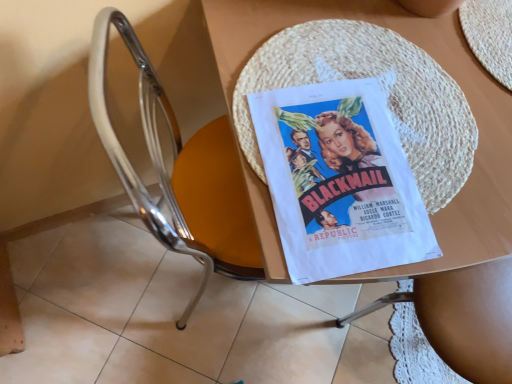
Question: Considering the positions of point (306, 223) and point (94, 105), is point (306, 223) closer or farther from the camera than point (94, 105)?

Choices:
 (A) closer
 (B) farther

Answer: (A)

Question: In terms of height, does white paper poster at center look taller or shorter compared to metallic chrome chair at center?

Choices:
 (A) tall
 (B) short

Answer: (B)

Question: Estimate the real-world distances between objects in this image. Which object is closer to the white paper poster at center?

Choices:
 (A) metallic chrome chair at center
 (B) wooden table at center

Answer: (B)

Question: Estimate the real-world distances between objects in this image. Which object is closer to the white paper poster at center?

Choices:
 (A) wooden table at center
 (B) metallic chrome chair at center

Answer: (A)